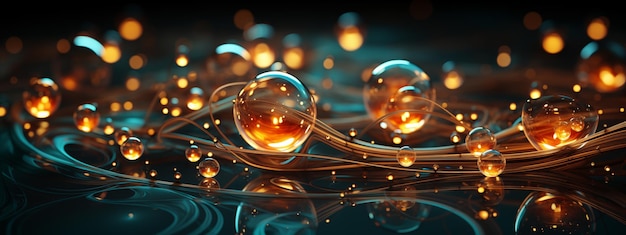
Where is `artwork`? This screenshot has width=626, height=235. artwork is located at coordinates (339, 100).